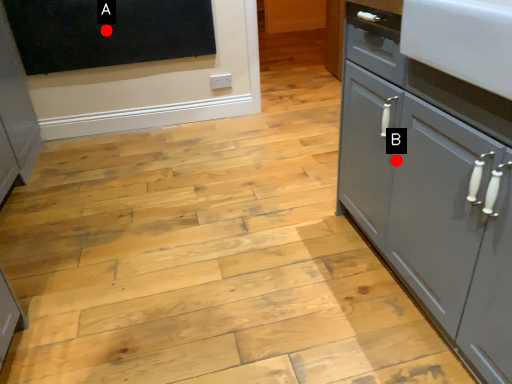
Question: Two points are circled on the image, labeled by A and B beside each circle. Which point appears farthest from the camera in this image?

Choices:
 (A) A is further
 (B) B is further

Answer: (A)